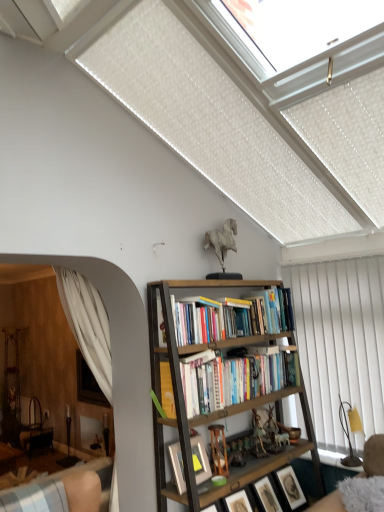
Question: Choose the correct answer: Is white vertical blinds at right inside matte black picture frame at center, which ranks as the 3th picture frame in right-to-left order, or outside it?

Choices:
 (A) inside
 (B) outside

Answer: (B)

Question: Is white vertical blinds at right bigger or smaller than matte black picture frame at center, which ranks as the 3th picture frame in right-to-left order?

Choices:
 (A) big
 (B) small

Answer: (A)

Question: Estimate the real-world distances between objects in this image. Which object is farther from the white vertical blinds at right?

Choices:
 (A) wooden picture frame at lower right, the third picture frame positioned from the left
 (B) white matte horse at upper center, positioned as the 2th toy in right-to-left order
 (C) matte black picture frame at center, which is counted as the first picture frame, starting from the left
 (D) wooden picture frame at lower center, the 2th picture frame from the right
 (E) wooden bookcase at center

Answer: (C)

Question: Which object is the farthest from the hardcover books at center?

Choices:
 (A) white matte horse at upper center, acting as the first toy starting from the top
 (B) wooden bookcase at center
 (C) matte black picture frame at center, which is counted as the first picture frame, starting from the left
 (D) wooden picture frame at lower center, the 2th picture frame from the right
 (E) metallic gold figurine at center, which is the first toy from bottom to top

Answer: (A)